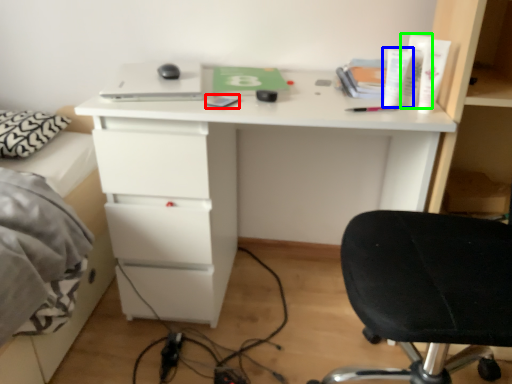
Question: Estimate the real-world distances between objects in this image. Which object is closer to notepad (highlighted by a red box), toiletry (highlighted by a blue box) or toiletry (highlighted by a green box)?

Choices:
 (A) toiletry
 (B) toiletry

Answer: (A)